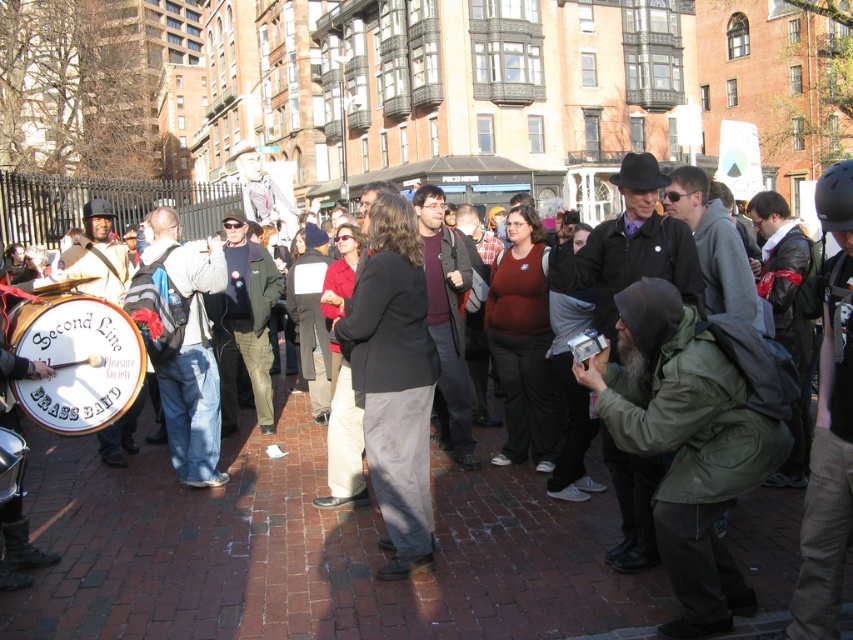
Question: Which object is the farthest from the dark gray suit at center?

Choices:
 (A) brick pavement at center
 (B) matte black drum at lower left
 (C) white leather drum at left

Answer: (B)

Question: Where is brick pavement at center located in relation to matte black drum at lower left in the image?

Choices:
 (A) left
 (B) right

Answer: (B)

Question: Is brick pavement at center wider than dark gray suit at center?

Choices:
 (A) no
 (B) yes

Answer: (B)

Question: Among these points, which one is farthest from the camera?

Choices:
 (A) (96, 536)
 (B) (68, 380)
 (C) (9, 460)
 (D) (418, 362)

Answer: (D)

Question: Which point is closer to the camera?

Choices:
 (A) (10, 436)
 (B) (405, 500)
 (C) (173, 580)
 (D) (103, 353)

Answer: (A)

Question: Does brick pavement at center appear over dark gray suit at center?

Choices:
 (A) yes
 (B) no

Answer: (B)